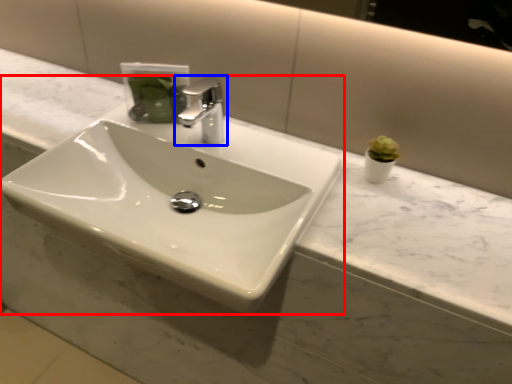
Question: Which object is further to the camera taking this photo, sink (highlighted by a red box) or tap (highlighted by a blue box)?

Choices:
 (A) sink
 (B) tap

Answer: (B)